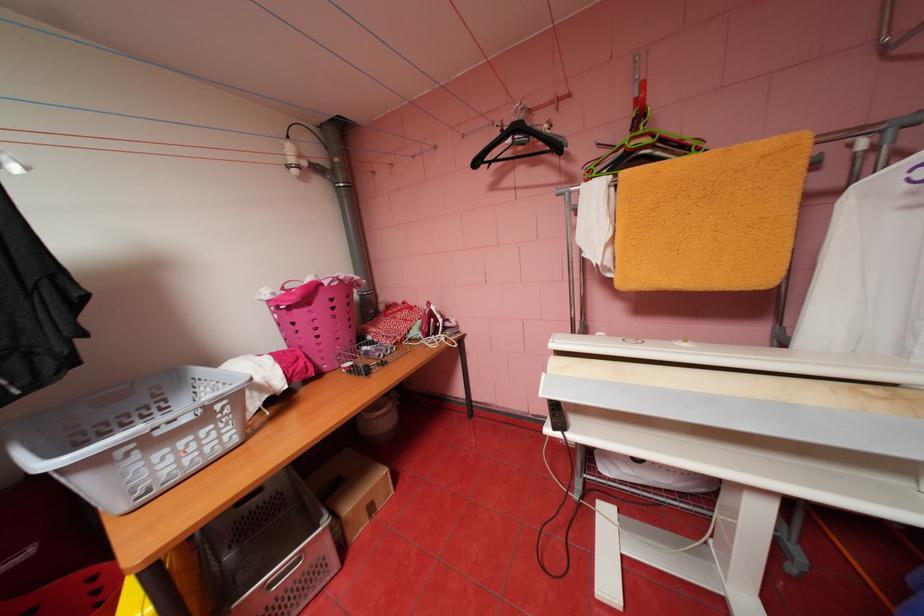
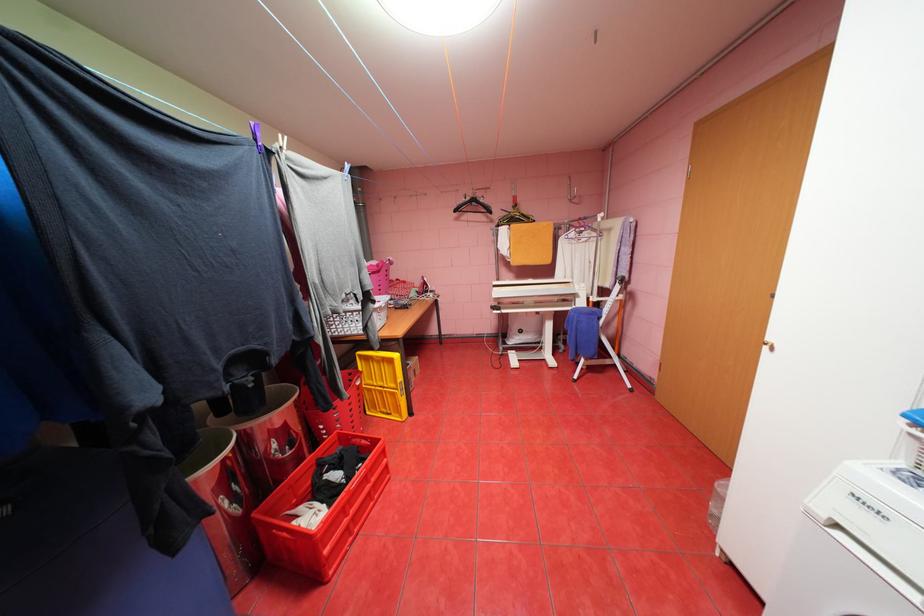
Find the pixel in the second image that matches point 484,163 in the first image.

(464, 209)